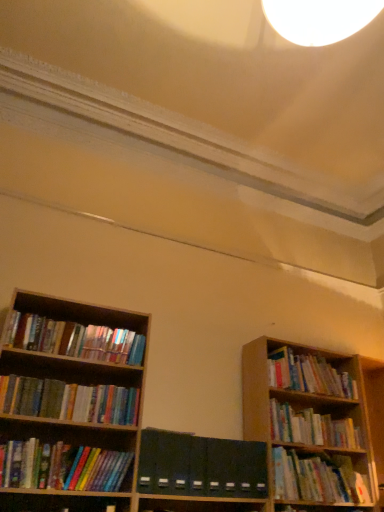
Question: Is dark green matte folder at center further to the viewer compared to wooden bookshelf at right, the 1th book viewed from the right?

Choices:
 (A) yes
 (B) no

Answer: (B)

Question: From the image's perspective, is dark green matte folder at center located above wooden bookshelf at right, which is the 6th book in left-to-right order?

Choices:
 (A) no
 (B) yes

Answer: (A)

Question: Is dark green matte folder at center to the right of wooden bookshelf at right, the 1th book viewed from the right, from the viewer's perspective?

Choices:
 (A) no
 (B) yes

Answer: (A)

Question: Is dark green matte folder at center taller than wooden bookshelf at right, the 1th book viewed from the right?

Choices:
 (A) yes
 (B) no

Answer: (A)

Question: Considering the relative sizes of dark green matte folder at center and wooden bookshelf at right, which is the 6th book in left-to-right order, in the image provided, is dark green matte folder at center smaller than wooden bookshelf at right, which is the 6th book in left-to-right order,?

Choices:
 (A) yes
 (B) no

Answer: (A)

Question: From a real-world perspective, is dark green matte folder at center located beneath wooden bookshelf at right, which is the 6th book in left-to-right order?

Choices:
 (A) yes
 (B) no

Answer: (A)

Question: Is wooden bookshelf at right, the 1th book viewed from the right, oriented towards dark green matte folder at center?

Choices:
 (A) yes
 (B) no

Answer: (B)

Question: Does wooden bookshelf at right, which is the 6th book in left-to-right order, have a smaller size compared to dark green matte folder at center?

Choices:
 (A) yes
 (B) no

Answer: (B)

Question: Is wooden bookshelf at right, which is the 6th book in left-to-right order, at the right side of dark green matte folder at center?

Choices:
 (A) yes
 (B) no

Answer: (A)

Question: Is wooden bookshelf at right, the 1th book viewed from the right, shorter than dark green matte folder at center?

Choices:
 (A) no
 (B) yes

Answer: (B)

Question: Can you confirm if wooden bookshelf at right, which is the 6th book in left-to-right order, is bigger than dark green matte folder at center?

Choices:
 (A) yes
 (B) no

Answer: (A)

Question: Does wooden bookshelf at right, the 1th book viewed from the right, touch dark green matte folder at center?

Choices:
 (A) yes
 (B) no

Answer: (B)

Question: Is wooden bookshelf at right, which is the 6th book in left-to-right order, further to camera compared to hardcover books at lower right, the third book positioned from the right?

Choices:
 (A) yes
 (B) no

Answer: (A)